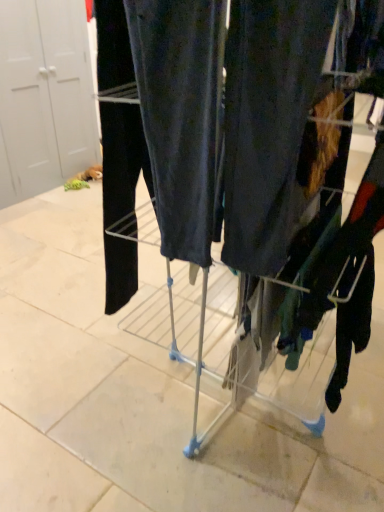
This screenshot has height=512, width=384. I want to click on vacant space to the left of metallic silver trolley at center, so click(87, 385).